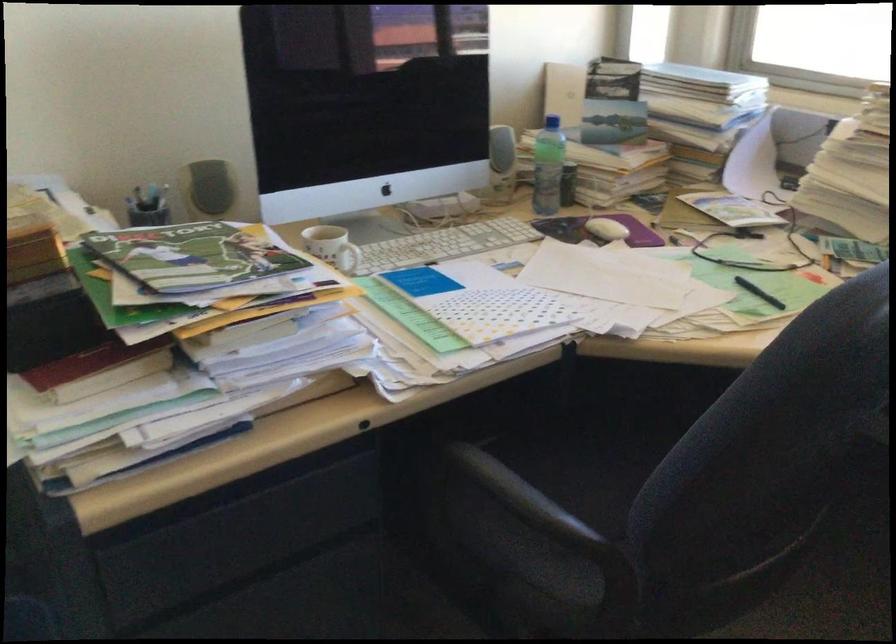
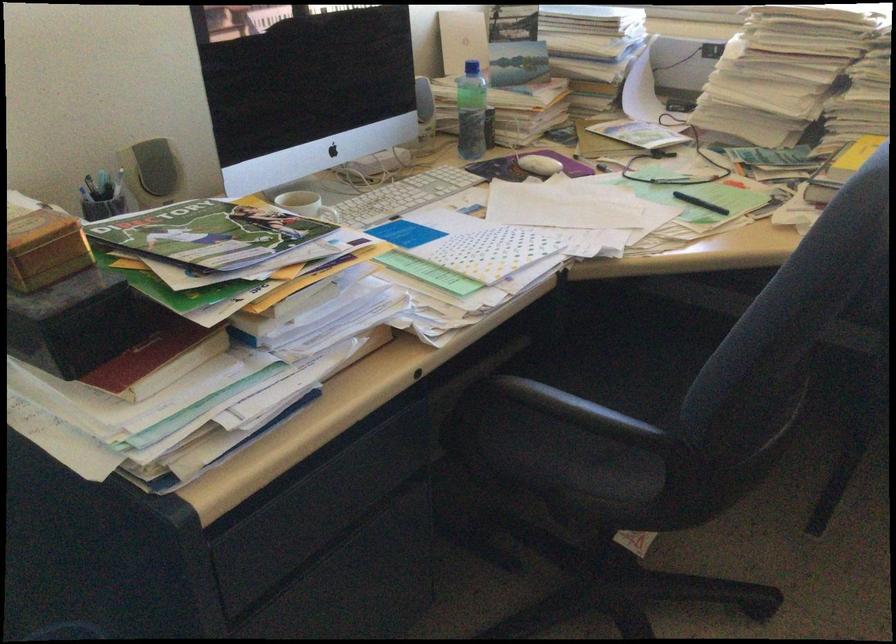
Find the pixel in the second image that matches (543,166) in the first image.

(470, 111)